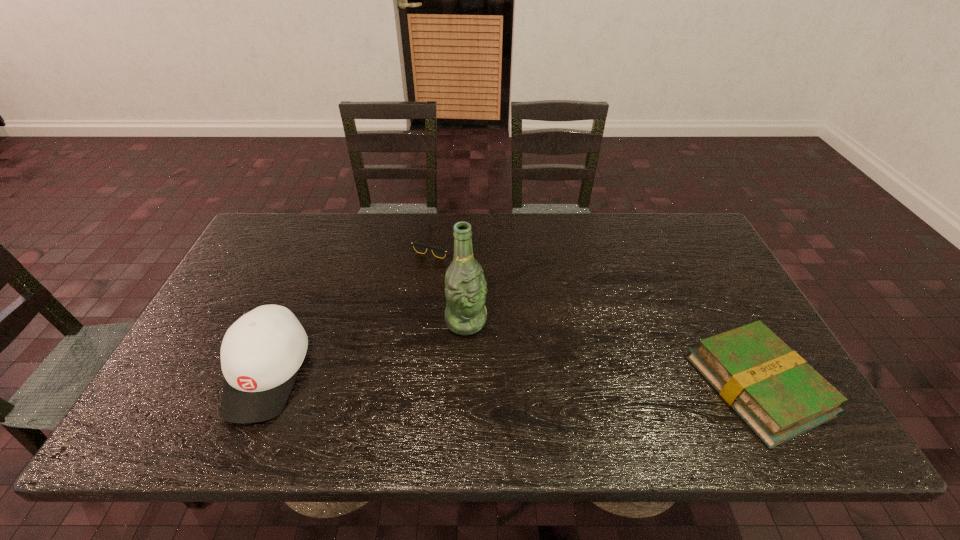
Where is `vacant area that lies between the tallest object and the rightmost object`? The image size is (960, 540). vacant area that lies between the tallest object and the rightmost object is located at coordinates (612, 353).

Where is `object that is the second closest to the beer bottle`? object that is the second closest to the beer bottle is located at coordinates coord(261,353).

Where is `the second closest object to the leftmost object`? The width and height of the screenshot is (960, 540). the second closest object to the leftmost object is located at coordinates (419, 247).

Image resolution: width=960 pixels, height=540 pixels. I want to click on free space that satisfies the following two spatial constraints: 1. on the front-facing side of the baseball cap; 2. on the left side of the second shortest object, so click(262, 386).

The width and height of the screenshot is (960, 540). Find the location of `free region that satisfies the following two spatial constraints: 1. on the front-facing side of the baseball cap; 2. on the left side of the rightmost object`. free region that satisfies the following two spatial constraints: 1. on the front-facing side of the baseball cap; 2. on the left side of the rightmost object is located at coordinates (262, 386).

The height and width of the screenshot is (540, 960). In order to click on vacant space that satisfies the following two spatial constraints: 1. on the front side of the rightmost object; 2. on the left side of the farthest object in this screenshot , I will do `click(422, 386)`.

I want to click on vacant position in the image that satisfies the following two spatial constraints: 1. on the front side of the book; 2. on the left side of the tallest object, so click(x=464, y=386).

Where is `vacant space that satisfies the following two spatial constraints: 1. on the front side of the beer bottle; 2. on the right side of the second shortest object`? This screenshot has width=960, height=540. vacant space that satisfies the following two spatial constraints: 1. on the front side of the beer bottle; 2. on the right side of the second shortest object is located at coordinates (464, 386).

Identify the location of blank space that satisfies the following two spatial constraints: 1. on the front side of the book; 2. on the right side of the sunglasses. (422, 386).